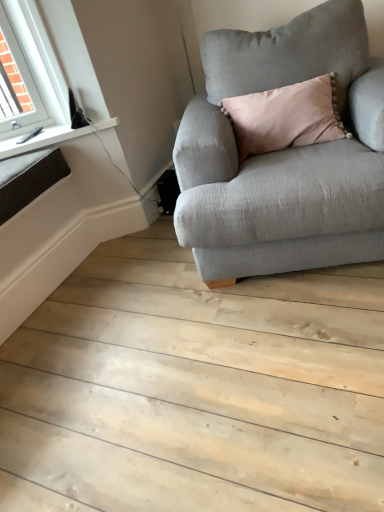
Measure the distance between point (267, 72) and camera.

The distance of point (267, 72) from camera is 6.07 feet.

I want to click on light gray fabric couch at center, so click(x=284, y=155).

What do you see at coordinates (284, 155) in the screenshot? I see `light gray fabric couch at center` at bounding box center [284, 155].

I want to click on light gray fabric couch at center, so click(284, 155).